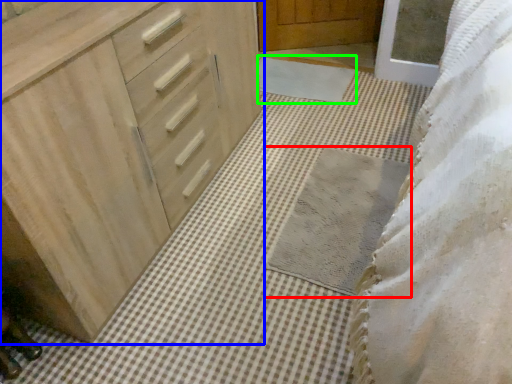
Question: Considering the real-world distances, which object is farthest from bath mat (highlighted by a red box)? chest of drawers (highlighted by a blue box) or bath mat (highlighted by a green box)?

Choices:
 (A) chest of drawers
 (B) bath mat

Answer: (B)